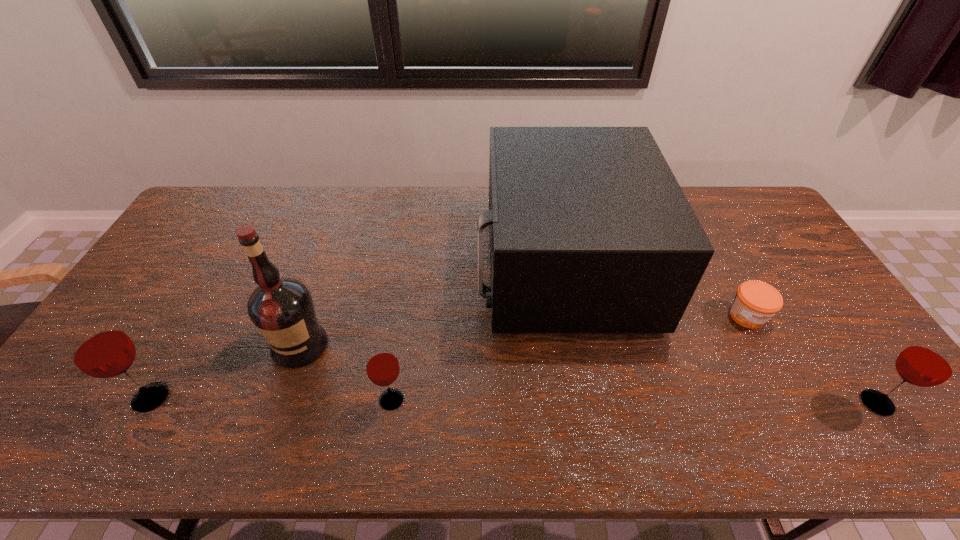
I want to click on vacant point located between the second shortest object and the leftmost object, so click(272, 399).

I want to click on free space that is in between the shortest object and the leftmost glass, so click(449, 357).

At what (x,y) coordinates should I click in order to perform the action: click on the second closest object to the microwave oven. Please return your answer as a coordinate pair (x, y). The image size is (960, 540). Looking at the image, I should click on (382, 367).

The height and width of the screenshot is (540, 960). Identify the location of the closest object to the fifth shortest object. (755, 302).

The height and width of the screenshot is (540, 960). What are the coordinates of `glass that is the closest to the jam` in the screenshot? It's located at (931, 361).

Locate which glass is the closest to the shortest glass. Please provide its 2D coordinates. Your answer should be formatted as a tuple, i.e. [(x, y)], where the tuple contains the x and y coordinates of a point satisfying the conditions above.

[(98, 348)]

Find the location of a particular element. The image size is (960, 540). vacant space that satisfies the following two spatial constraints: 1. on the front-facing side of the second tallest glass; 2. on the right side of the third object from right to left is located at coordinates (586, 403).

Image resolution: width=960 pixels, height=540 pixels. I want to click on free space that satisfies the following two spatial constraints: 1. on the front label of the second tallest glass; 2. on the left side of the jam, so click(794, 403).

Identify the location of vacant space that satisfies the following two spatial constraints: 1. on the front-facing side of the rightmost glass; 2. on the right side of the fifth shortest object. The width and height of the screenshot is (960, 540). click(x=586, y=403).

This screenshot has width=960, height=540. I want to click on free point that satisfies the following two spatial constraints: 1. on the front label of the jam; 2. on the right side of the rightmost object, so click(x=794, y=403).